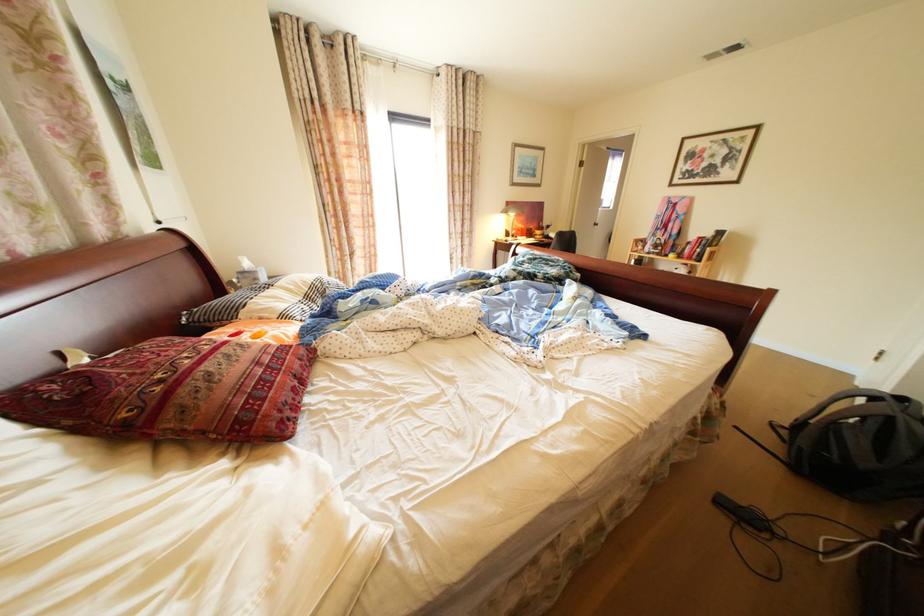
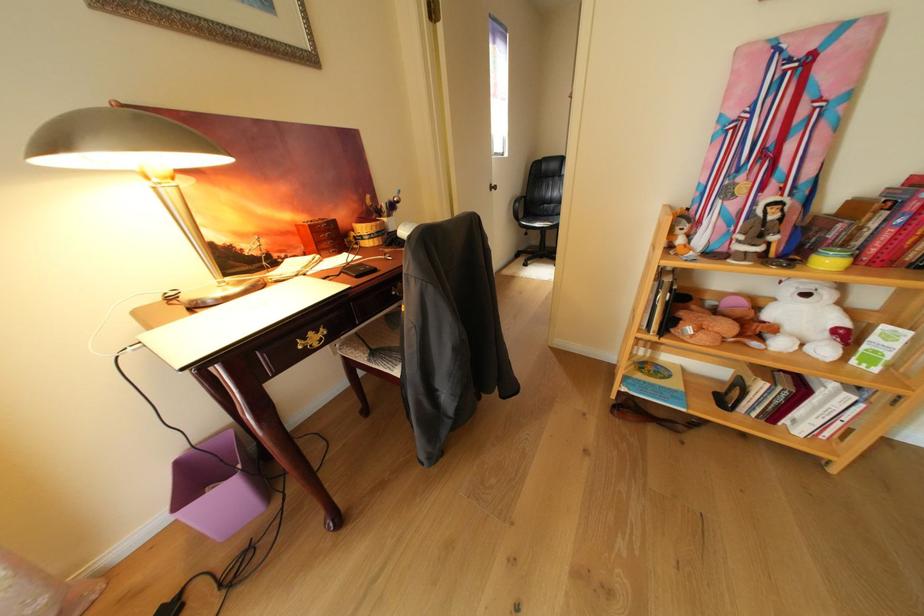
Where in the second image is the point corresponding to [650,246] from the first image?

(689, 230)